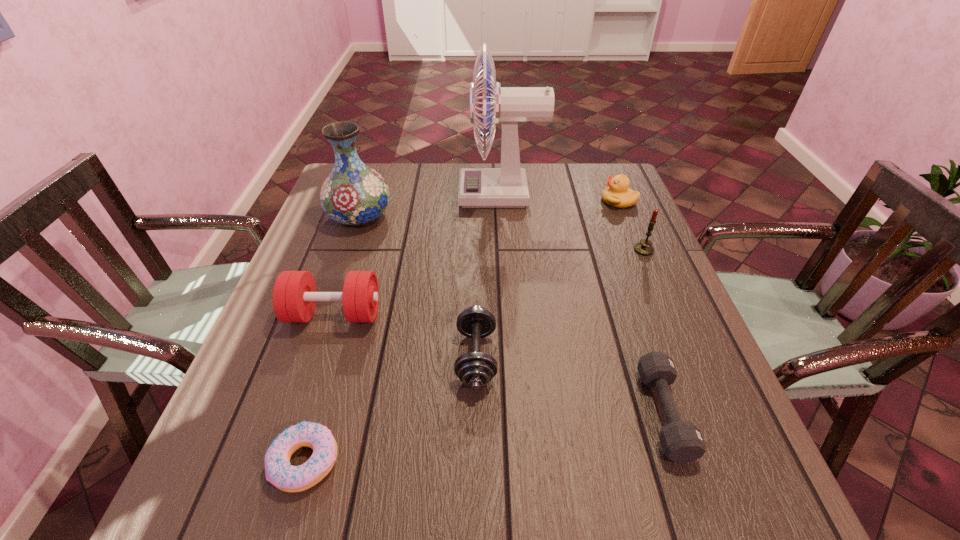
Choose which object is the fifth nearest neighbor to the leftmost dumbbell. Please provide its 2D coordinates. Your answer should be formatted as a tuple, i.e. [(x, y)], where the tuple contains the x and y coordinates of a point satisfying the conditions above.

[(681, 441)]

Identify which dumbbell is the third nearest to the vase. Please provide its 2D coordinates. Your answer should be formatted as a tuple, i.e. [(x, y)], where the tuple contains the x and y coordinates of a point satisfying the conditions above.

[(681, 441)]

Identify which dumbbell is located as the second nearest to the candle. Please provide its 2D coordinates. Your answer should be formatted as a tuple, i.e. [(x, y)], where the tuple contains the x and y coordinates of a point satisfying the conditions above.

[(475, 369)]

Image resolution: width=960 pixels, height=540 pixels. In order to click on vacant region that satisfies the following two spatial constraints: 1. on the back side of the doughnut; 2. on the left side of the second shortest dumbbell in this screenshot , I will do `click(336, 357)`.

Where is `free region that satisfies the following two spatial constraints: 1. on the front side of the tallest dumbbell; 2. on the left side of the doughnut`? Image resolution: width=960 pixels, height=540 pixels. free region that satisfies the following two spatial constraints: 1. on the front side of the tallest dumbbell; 2. on the left side of the doughnut is located at coordinates (287, 461).

This screenshot has width=960, height=540. In order to click on free point that satisfies the following two spatial constraints: 1. on the front-facing side of the duckling; 2. on the right side of the candle in this screenshot , I will do `click(639, 250)`.